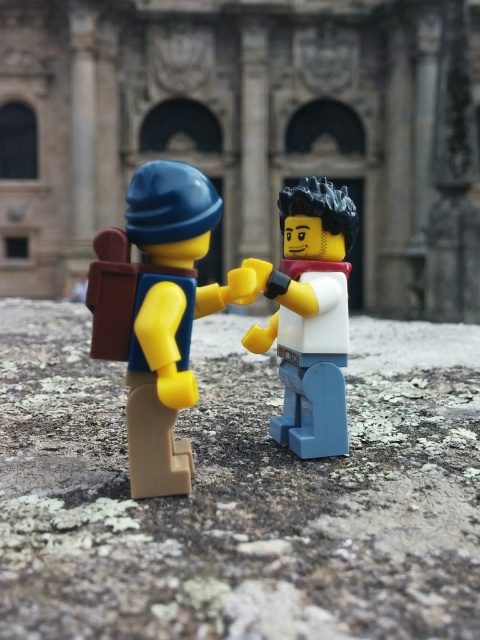
You are a photographer setting up a shot of the two LEGO minifigures. You want to ensure the matte yellow backpack at left and the white matte figure at center are both in focus. Based on their positions, which object is closer to the camera?

The matte yellow backpack at left is to the left of the white matte figure at center, so the backpack is closer to the camera since it is positioned to the left.